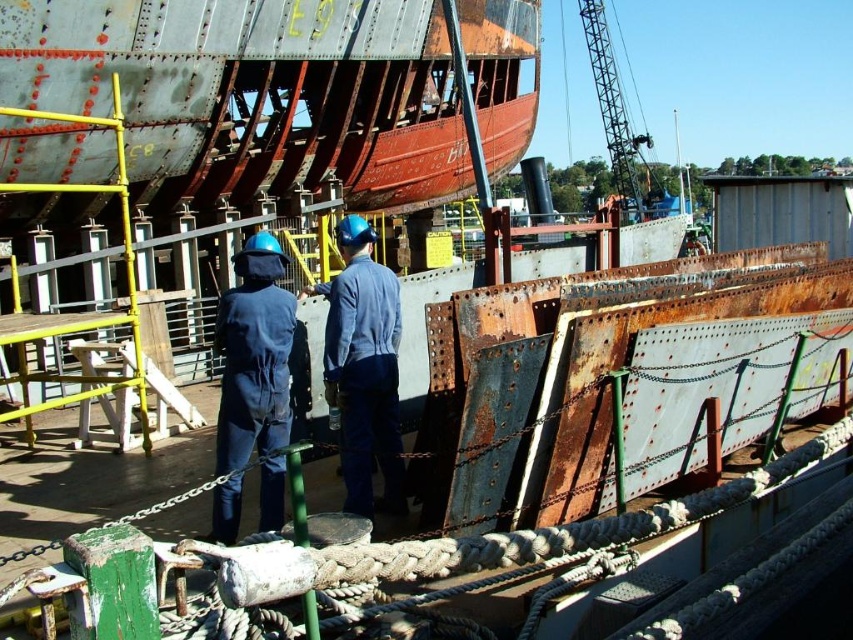
The width and height of the screenshot is (853, 640). What do you see at coordinates (254, 355) in the screenshot?
I see `blue fabric jumpsuit at center` at bounding box center [254, 355].

Is blue fabric jumpsuit at center taller than brushed metal crane at upper center?

No, blue fabric jumpsuit at center is not taller than brushed metal crane at upper center.

Locate an element on the screen. blue fabric jumpsuit at center is located at coordinates (254, 355).

Does blue fabric jumpsuit at center appear on the right side of blue denim shirt at center?

Incorrect, blue fabric jumpsuit at center is not on the right side of blue denim shirt at center.

Between point (271, 529) and point (380, 349), which one is positioned behind?

The point (380, 349) is more distant.

Identify the location of blue fabric jumpsuit at center. The width and height of the screenshot is (853, 640). (254, 355).

Is blue denim shirt at center closer to the viewer compared to brushed metal crane at upper center?

Yes, it is in front of brushed metal crane at upper center.

Is blue denim shirt at center taller than brushed metal crane at upper center?

Incorrect, blue denim shirt at center's height is not larger of brushed metal crane at upper center's.

Is point (360, 461) positioned before point (602, 32)?

Yes, it is in front of point (602, 32).

I want to click on blue denim shirt at center, so [364, 369].